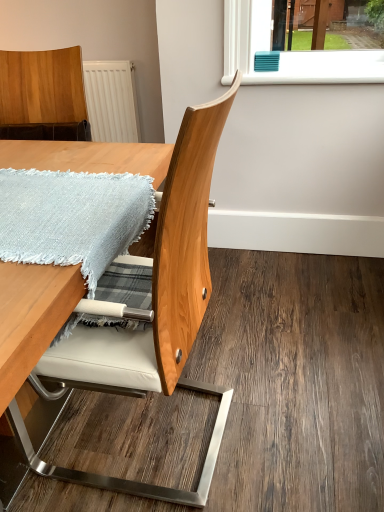
The width and height of the screenshot is (384, 512). Identify the location of free spot above wooden chair at lower right (from a real-world perspective). (303, 334).